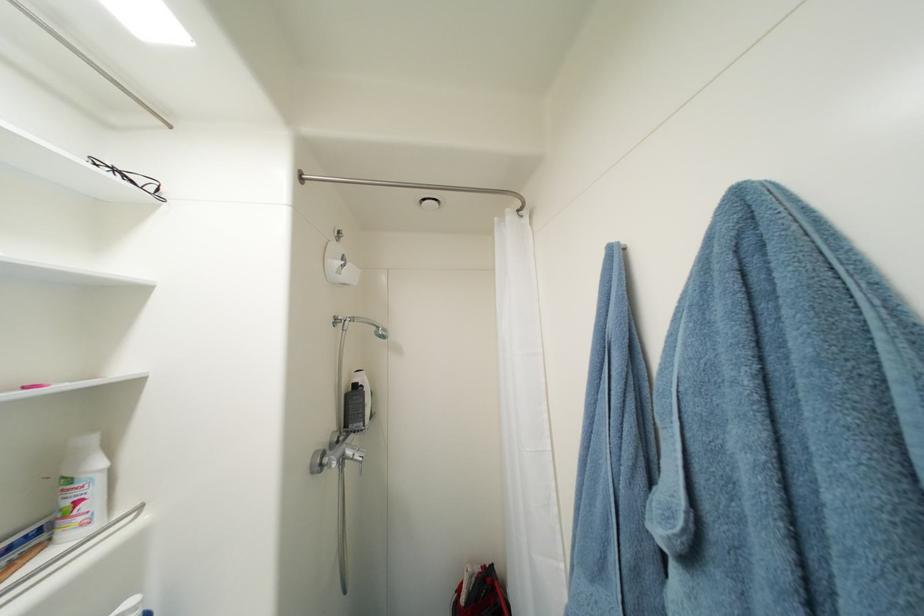
The height and width of the screenshot is (616, 924). Find the location of `shower faucet handle`. shower faucet handle is located at coordinates (334, 570).